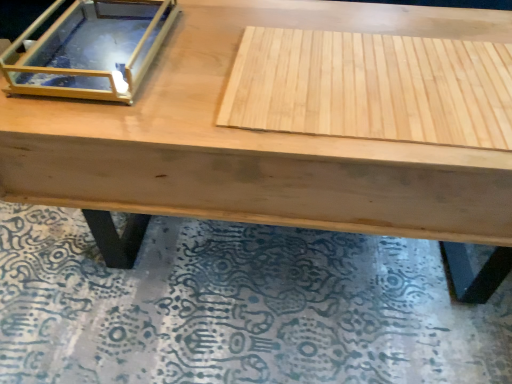
Find the location of a particular element. This screenshot has height=384, width=512. free space above wooden mat at lower center (from a real-world perspective) is located at coordinates (223, 294).